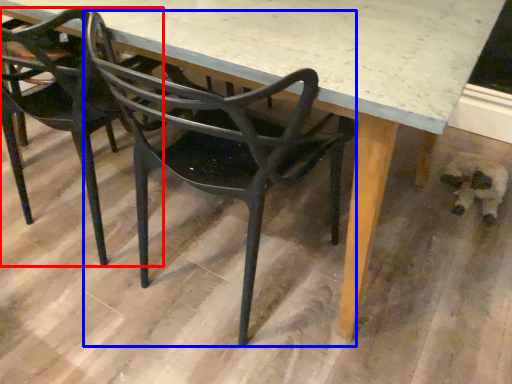
Question: Which object appears closest to the camera in this image, chair (highlighted by a red box) or chair (highlighted by a blue box)?

Choices:
 (A) chair
 (B) chair

Answer: (B)